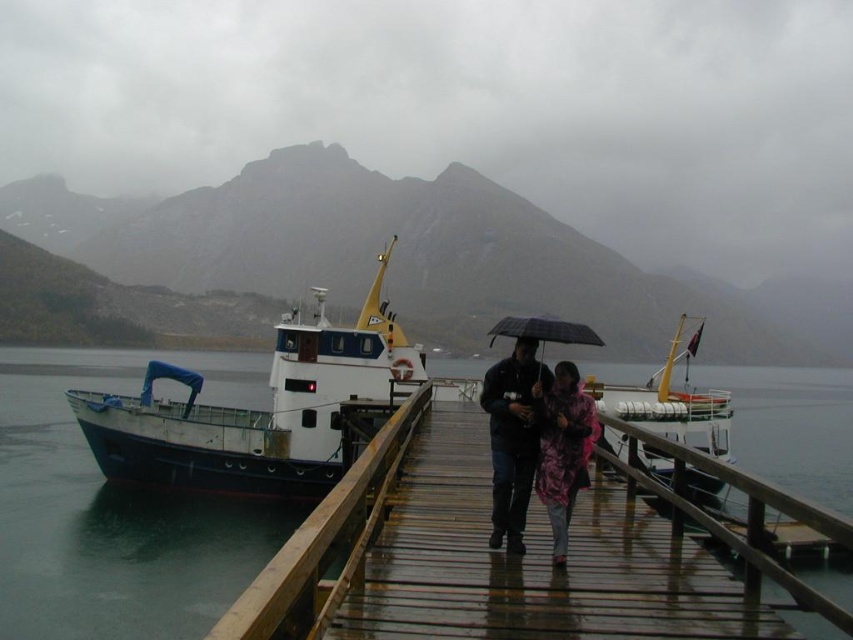
You are a photographer standing at the dock in the rainy scene. You have a pink camouflage jacket at center and a camera. You want to take a photo of the mountains in the background without the jacket blocking the view. Can you move the camera closer to the jacket to frame the mountains properly?

The pink camouflage jacket at center and camera are 38.67 feet apart from each other. Moving the camera closer to the jacket would reduce the distance, but since the jacket is at the center, moving the camera towards it might still block the mountain view. Alternatively, moving the camera away from the jacket could provide a clearer background. However, the exact positioning depends on the desired framing and angle.

You are a hiker who just arrived at the dock and need to find your camouflage jacket at center. Based on the coordinates provided, where should you look relative to the boat on the left?

The camouflage jacket at center is located at coordinates point (534, 442), which is to the right of the boat on the left.

You are standing at the dock and want to walk towards the two points marked in the image. Which point, point (556, 532) or point (556, 483), is closer to you?

Point (556, 532) is closer to the viewer than point (556, 483).